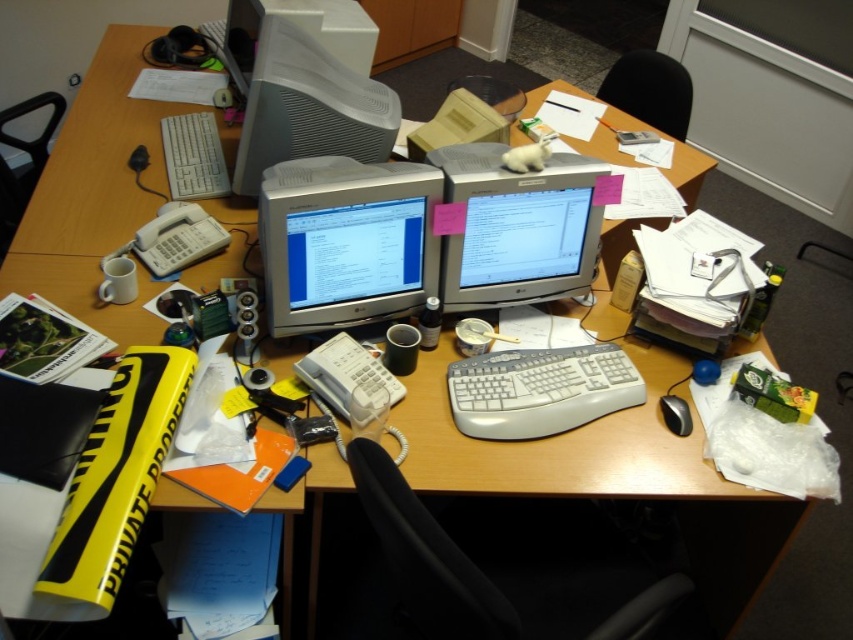
You are setting up a new desk arrangement and want to place a laptop between the white plastic keyboard at center and the white plastic monitor at upper center. Based on their current positions, where should the laptop be placed relative to the keyboard?

The white plastic keyboard at center is located below the white plastic monitor at upper center, so placing the laptop between them would require positioning it above the keyboard and below the monitor.

You are a delivery person who needs to place a small package on the desk without moving any items. The package is 0.5 meters long. Is there enough space between the white plastic keyboard at center and the white plastic monitor at upper center to place it?

The distance between the white plastic keyboard at center and the white plastic monitor at upper center is 1.05 meters. Since the package is 0.5 meters long, there is sufficient space to place it between them.